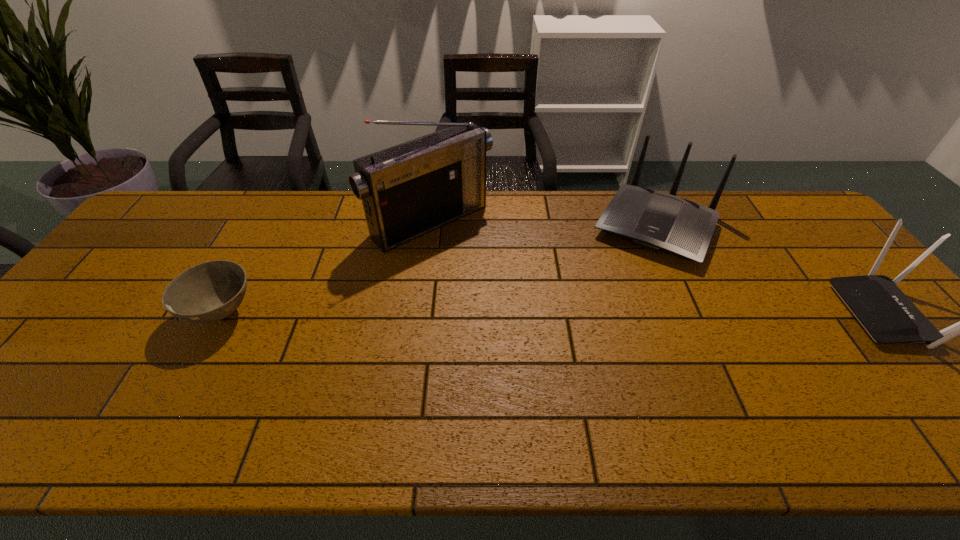
This screenshot has height=540, width=960. Find the location of `free region located 0.080m on the front-facing side of the third shortest object`. free region located 0.080m on the front-facing side of the third shortest object is located at coordinates (627, 282).

This screenshot has width=960, height=540. I want to click on free space located 0.160m on the front-facing side of the third shortest object, so click(617, 300).

You are a GUI agent. You are given a task and a screenshot of the screen. Output one action in this format:
    pyautogui.click(x=<x>, y=<y>)
    Task: Click on the free space located on the front-facing side of the third shortest object
    This screenshot has height=540, width=960.
    Given the screenshot: What is the action you would take?
    pyautogui.click(x=615, y=305)

Identify the location of radio receiver located in the far edge section of the desktop. The width and height of the screenshot is (960, 540). (408, 190).

I want to click on router present at the far edge, so click(654, 220).

This screenshot has width=960, height=540. In order to click on vacant region at the far edge of the desktop in this screenshot , I will do `click(496, 194)`.

Where is `vacant space at the near edge of the desktop`? vacant space at the near edge of the desktop is located at coordinates (588, 395).

Find the location of a particular element. The width and height of the screenshot is (960, 540). vacant space at the right edge of the desktop is located at coordinates (859, 347).

This screenshot has width=960, height=540. In the image, there is a desktop. In order to click on free space at the far left corner in this screenshot , I will do `click(163, 201)`.

Locate an element on the screen. The height and width of the screenshot is (540, 960). vacant space at the far right corner is located at coordinates (779, 213).